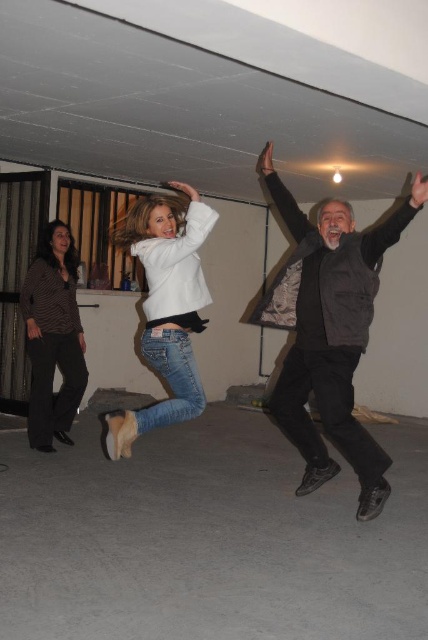
You are a fashion designer analyzing the clothing items in the scene. Which clothing item has a larger size between the white matte jacket at center and the dark brown knitted sweater at left?

The white matte jacket at center is bigger than the dark brown knitted sweater at left.

In the scene shown: You are a photographer standing in the room and want to capture a photo of the two jackets at center. Given that your camera has a depth of field that can focus on objects within 30 inches of each other, will both the dark gray textured jacket at center and the white matte jacket at center be in focus?

The dark gray textured jacket at center is 29.17 inches away from the white matte jacket at center. Since this distance is within the camera s 30 inches depth of field, both jackets will be in focus.

Please provide the 2D coordinates of the dark gray textured jacket at center in the image. The coordinates should be in the format of a point like this example format for reference only, not part of the answer. The answer must be precise and only include the numerical values without any additional text or explanation.

The 2D coordinates of the dark gray textured jacket at center are at point [332,342].